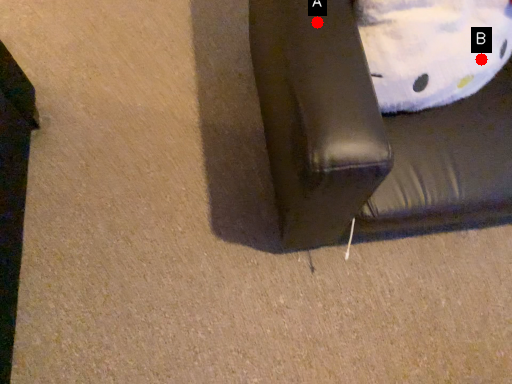
Question: Two points are circled on the image, labeled by A and B beside each circle. Which point is closer to the camera?

Choices:
 (A) A is closer
 (B) B is closer

Answer: (A)